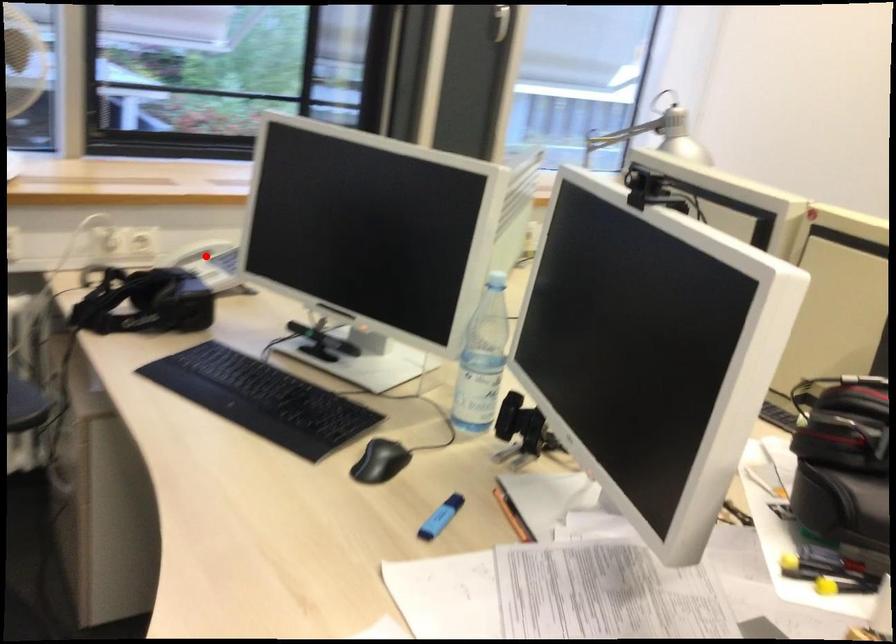
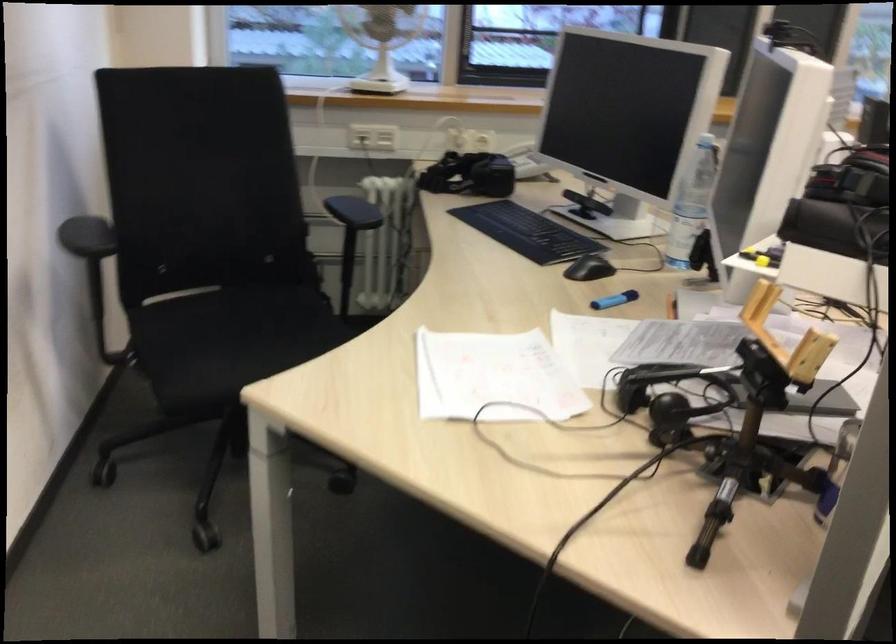
Question: I am providing you with two images of the same scene from different viewpoints. In image1, a red point is highlighted. Considering the same 3D point in image2, which of the following is correct?

Choices:
 (A) It is closer
 (B) It is farther

Answer: (B)